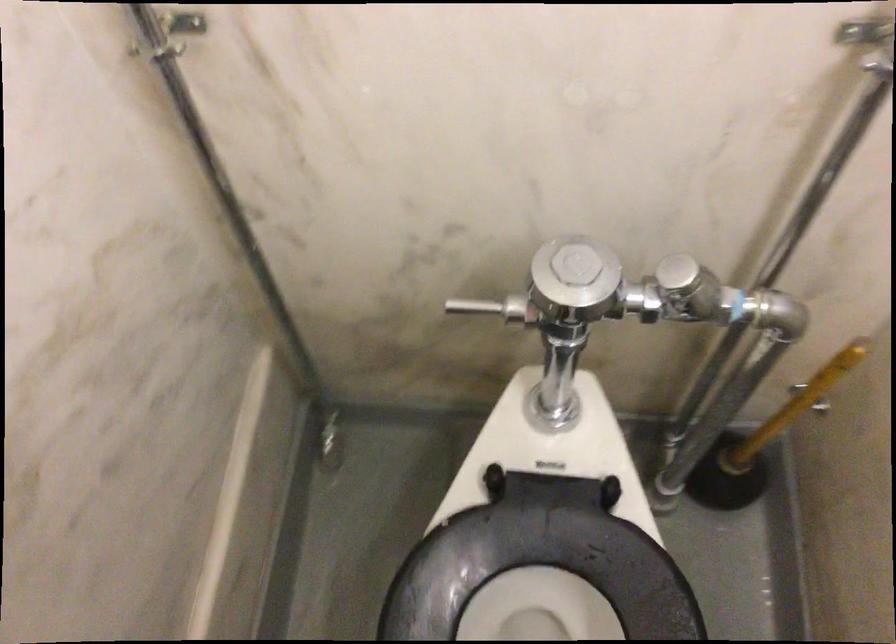
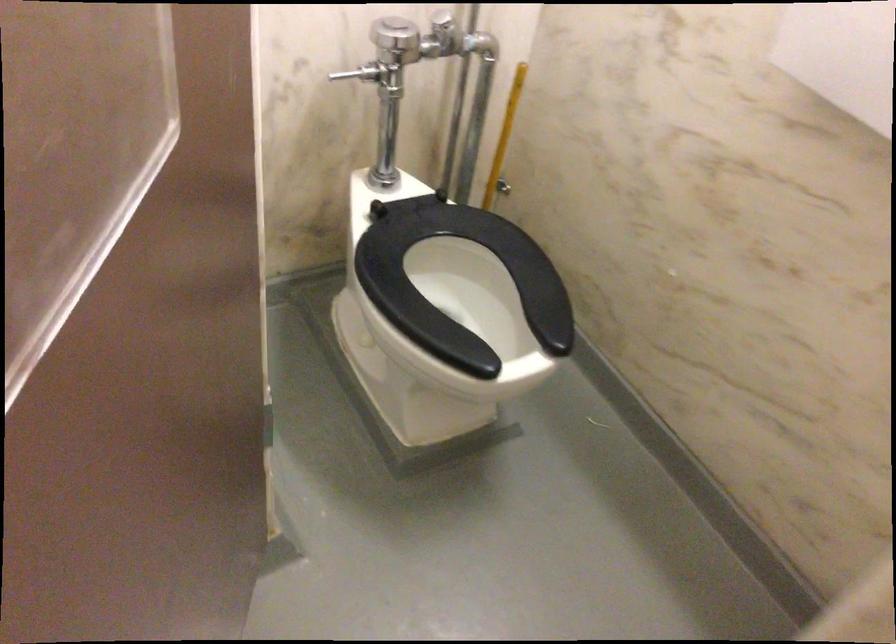
Find the pixel in the second image that matches (807,397) in the first image.

(504, 137)